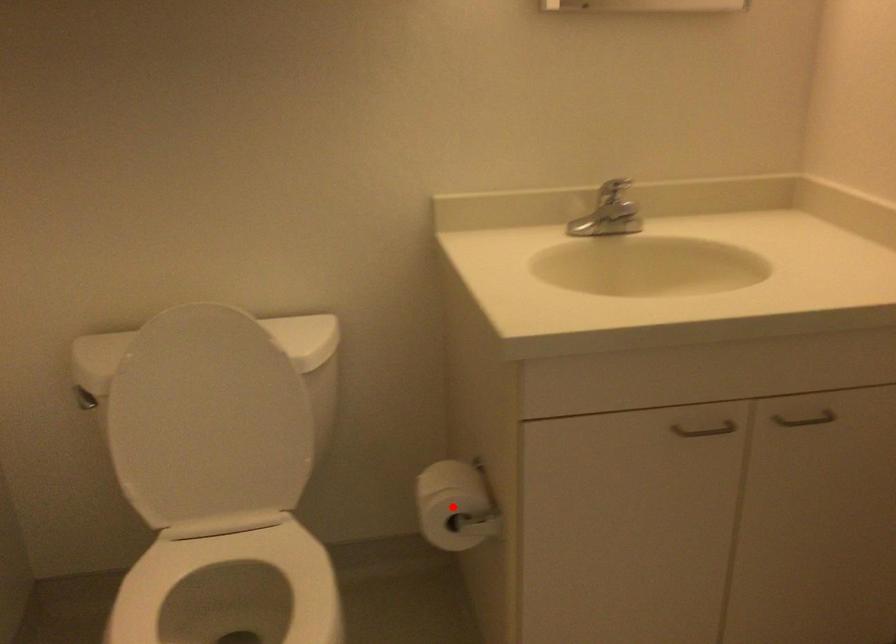
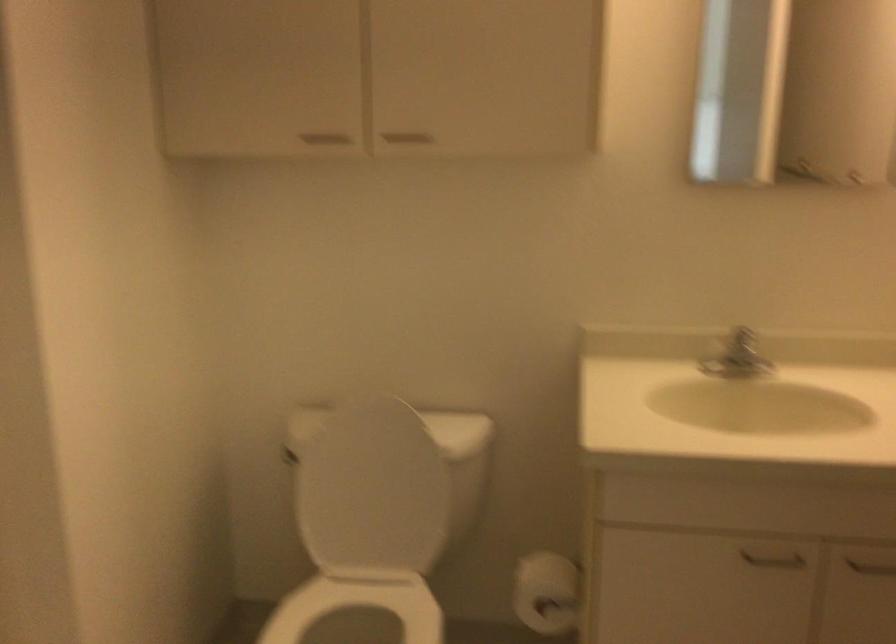
Question: I am providing you with two images of the same scene from different viewpoints. Image1 has a red point marked. In image2, the corresponding 3D location appears at what relative position? Reply with the corresponding letter.

Choices:
 (A) Closer
 (B) Farther

Answer: (B)